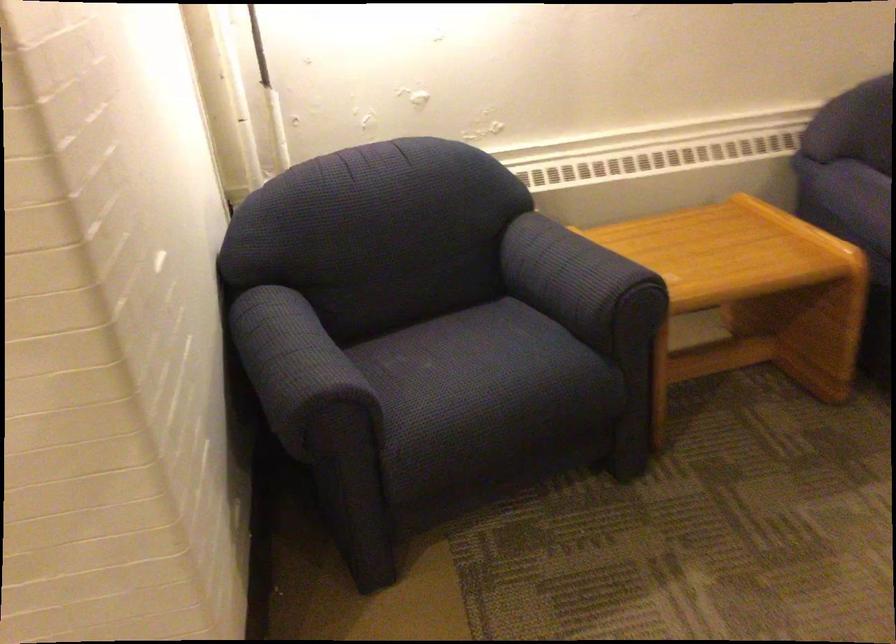
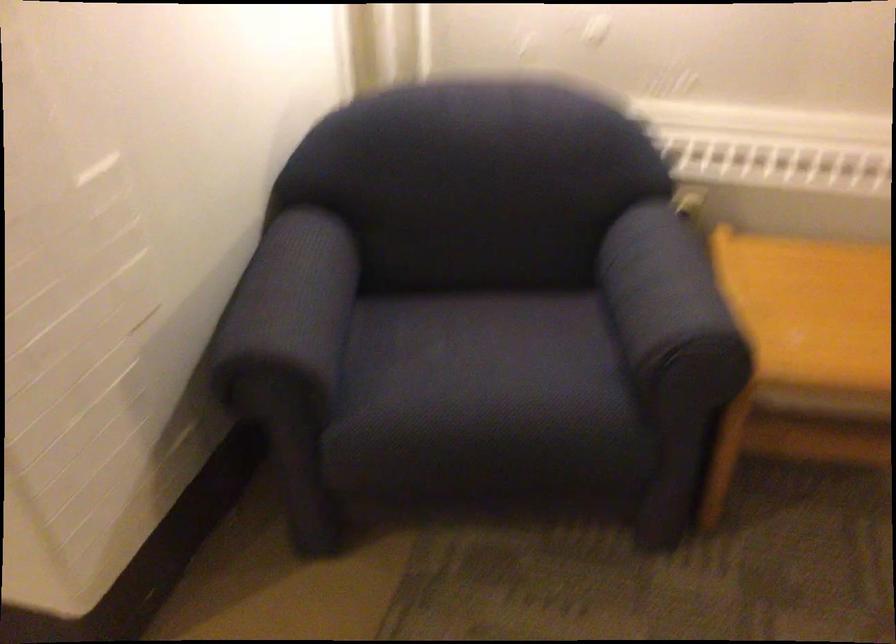
Find the pixel in the second image that matches point (325, 352) in the first image.

(289, 307)